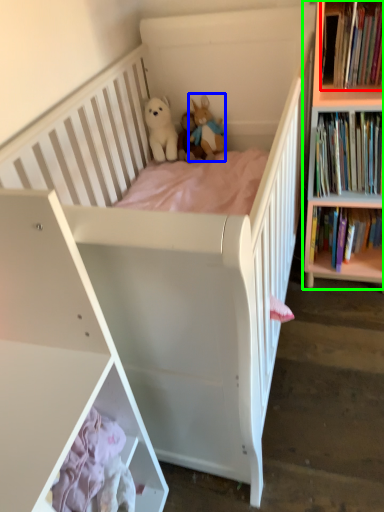
Question: Estimate the real-world distances between objects in this image. Which object is farther from book (highlighted by a red box), toy (highlighted by a blue box) or bookcase (highlighted by a green box)?

Choices:
 (A) toy
 (B) bookcase

Answer: (A)